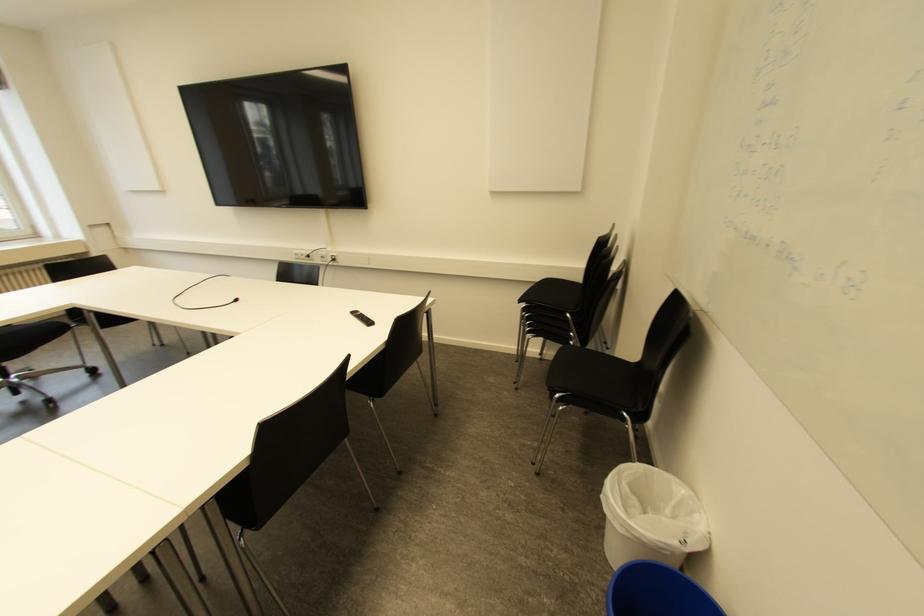
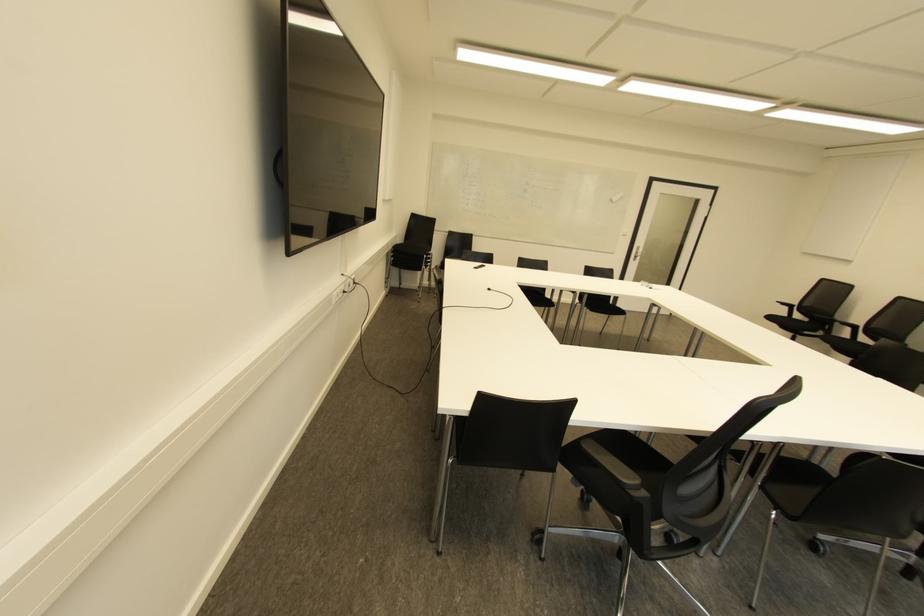
Locate, in the second image, the point that corresponds to [334,259] in the first image.

(354, 282)